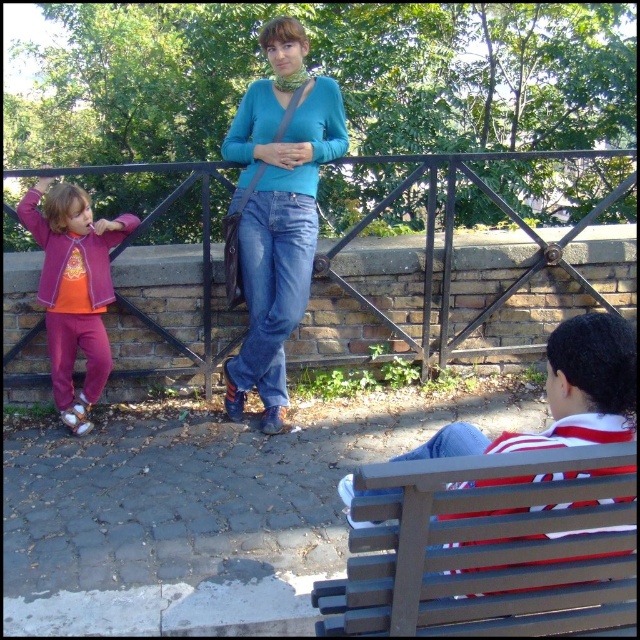
Which of these two, striped cotton shirt at lower right or blue denim jeans at center, stands taller?

Standing taller between the two is blue denim jeans at center.

Does striped cotton shirt at lower right have a smaller size compared to blue denim jeans at center?

Yes.

Who is more forward, (612, 420) or (301, 257)?

Point (612, 420)

Where is `striped cotton shirt at lower right`? striped cotton shirt at lower right is located at coordinates pos(564,394).

Is matte blue sweater at center to the left of striped cotton shirt at lower right from the viewer's perspective?

Indeed, matte blue sweater at center is positioned on the left side of striped cotton shirt at lower right.

Is point (268, 112) behind point (560, 344)?

Yes.

This screenshot has width=640, height=640. I want to click on matte blue sweater at center, so click(276, 211).

What are the coordinates of `matte blue sweater at center` in the screenshot? It's located at 276,211.

Does matte blue sweater at center have a smaller size compared to purple fleece jacket at left?

No, matte blue sweater at center is not smaller than purple fleece jacket at left.

Which is in front, point (305, 248) or point (100, 392)?

Point (305, 248) is more forward.

At what (x,y) coordinates should I click in order to perform the action: click on matte blue sweater at center. Please return your answer as a coordinate pair (x, y). Looking at the image, I should click on (276, 211).